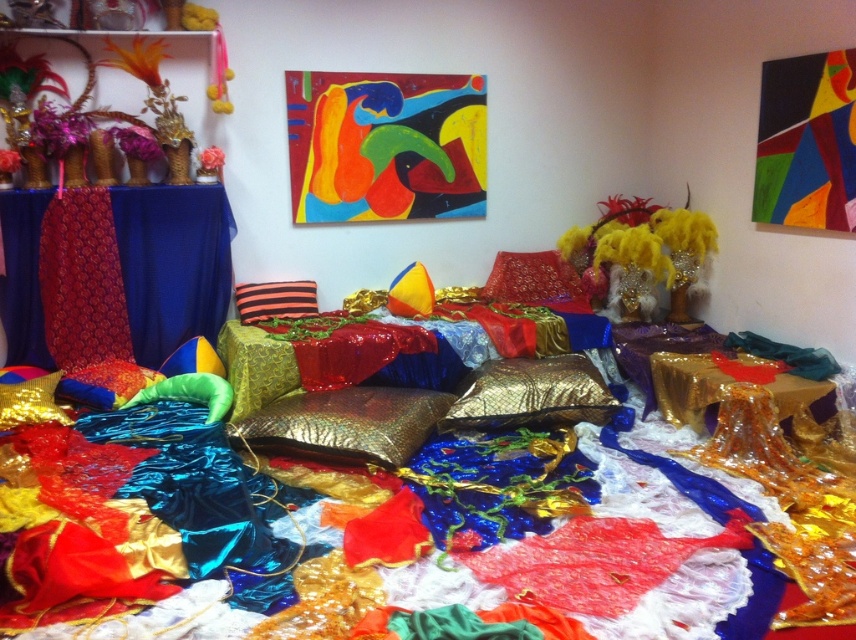
You are an interior designer arranging a room with a shiny red fabric pillow at center and a striped fabric pillow at center. Which pillow is positioned higher in the arrangement?

The shiny red fabric pillow at center is positioned higher than the striped fabric pillow at center.

You are arranging a photo shoot and need to know the layering of the pillows. Which pillow is on top of the other? The shiny red fabric pillow at center or the yellow shiny pillow at center?

The shiny red fabric pillow at center is positioned over yellow shiny pillow at center, so it is on top.